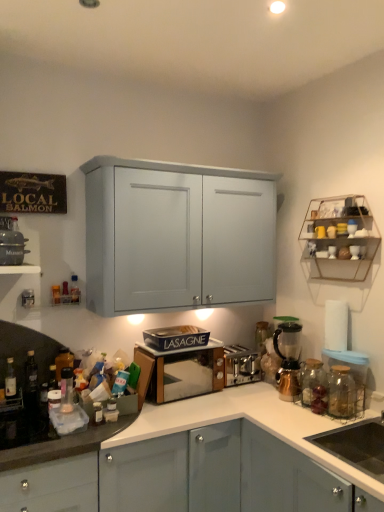
Question: Should I look upward or downward to see black glass bottle at left, marked as the fourth bottle in a back-to-front arrangement?

Choices:
 (A) down
 (B) up

Answer: (A)

Question: Is black matte sink at lower right thinner than translucent plastic bottle at center, which appears as the 5th bottle when viewed from the front?

Choices:
 (A) yes
 (B) no

Answer: (B)

Question: Is black matte sink at lower right wider than translucent plastic bottle at center, which is the 1th bottle in back-to-front order?

Choices:
 (A) no
 (B) yes

Answer: (B)

Question: Could translucent plastic bottle at center, the 4th bottle when ordered from left to right, be considered to be inside black matte sink at lower right?

Choices:
 (A) no
 (B) yes

Answer: (A)

Question: Is black matte sink at lower right positioned before translucent plastic bottle at center, which is the 1th bottle in back-to-front order?

Choices:
 (A) yes
 (B) no

Answer: (A)

Question: Can you confirm if black matte sink at lower right is positioned to the left of translucent plastic bottle at center, the 4th bottle when ordered from left to right?

Choices:
 (A) yes
 (B) no

Answer: (B)

Question: Does black matte sink at lower right have a larger size compared to translucent plastic bottle at center, which appears as the second bottle when viewed from the right?

Choices:
 (A) yes
 (B) no

Answer: (A)

Question: From the image's perspective, would you say transparent glass jar at right, acting as the first glass jar starting from the right, is shown under matte black pot at left, the third appliance positioned from the bottom?

Choices:
 (A) yes
 (B) no

Answer: (A)

Question: Is transparent glass jar at right, acting as the first glass jar starting from the right, turned away from matte black pot at left, positioned as the 3th appliance in back-to-front order?

Choices:
 (A) no
 (B) yes

Answer: (A)

Question: Is transparent glass jar at right, which is the 1th glass jar from front to back, beside matte black pot at left, placed as the first appliance when sorted from left to right?

Choices:
 (A) yes
 (B) no

Answer: (B)

Question: Is transparent glass jar at right, which is the 1th glass jar from front to back, to the right of matte black pot at left, positioned as the 3th appliance in right-to-left order, from the viewer's perspective?

Choices:
 (A) no
 (B) yes

Answer: (B)

Question: Does transparent glass jar at right, which is the 1th glass jar from front to back, lie behind matte black pot at left, the third appliance positioned from the bottom?

Choices:
 (A) no
 (B) yes

Answer: (B)

Question: Is transparent glass jar at right, the second glass jar in the back-to-front sequence, bigger than matte black pot at left, placed as the first appliance when sorted from left to right?

Choices:
 (A) yes
 (B) no

Answer: (B)

Question: From the image's perspective, is translucent plastic bottle at center, which is the 1th bottle in back-to-front order, over black matte sink at lower right?

Choices:
 (A) no
 (B) yes

Answer: (B)